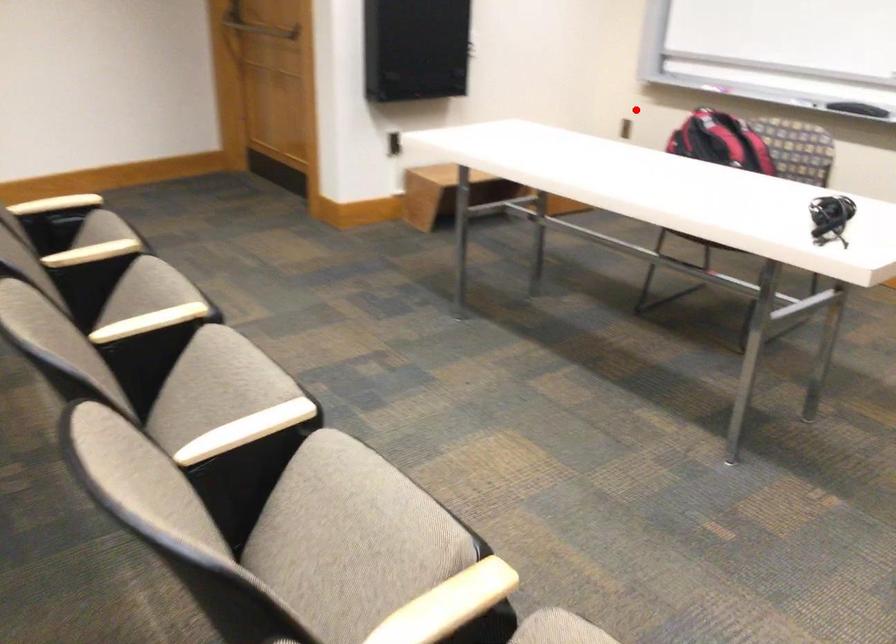
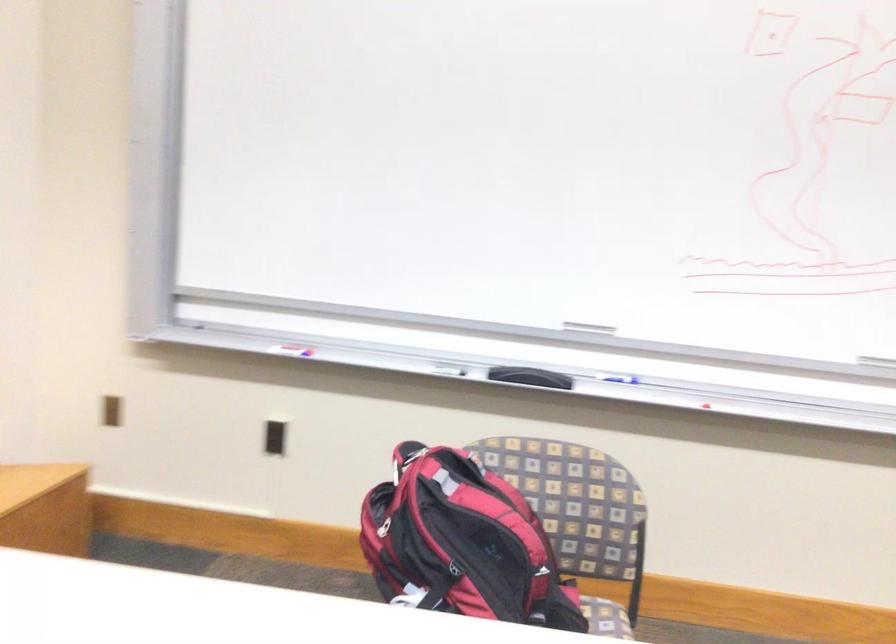
Locate, in the second image, the point that corresponds to the highlighted location in the first image.

(112, 410)